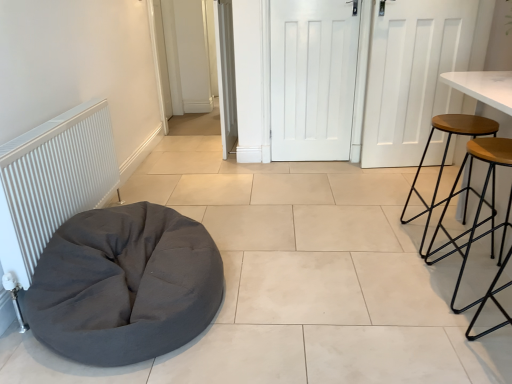
Where is `vacant region to the right of dark gray fabric bean bag at lower left`? vacant region to the right of dark gray fabric bean bag at lower left is located at coordinates (301, 284).